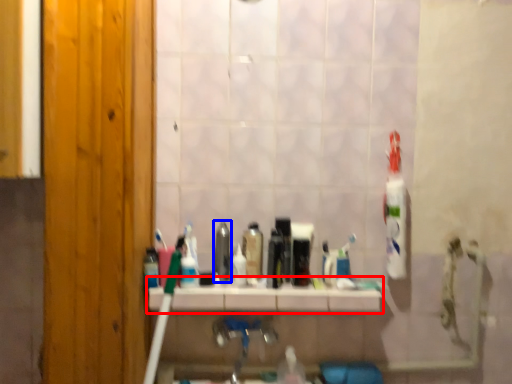
Question: Which object appears closest to the camera in this image, counter top (highlighted by a red box) or mouthwash (highlighted by a blue box)?

Choices:
 (A) counter top
 (B) mouthwash

Answer: (A)